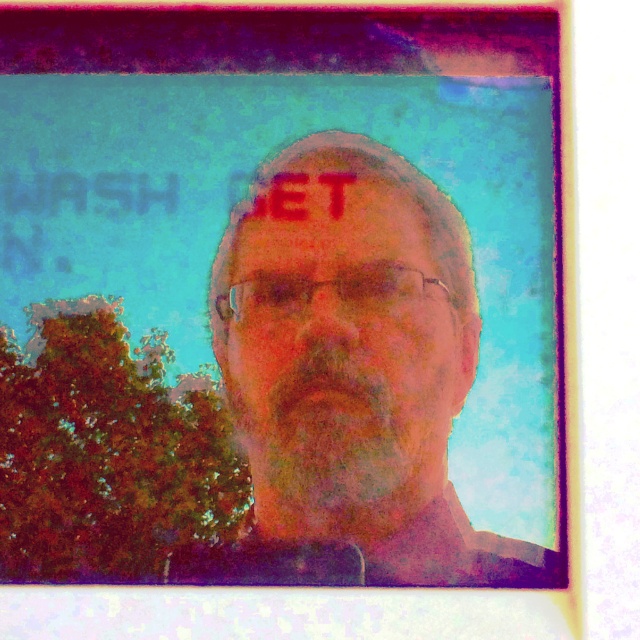
In the scene shown: Which of these two, matte skin face at center or matte skin at center, stands taller?

With more height is matte skin face at center.

Is matte skin face at center below matte skin at center?

Indeed, matte skin face at center is positioned under matte skin at center.

Does point (292, 465) come in front of point (236, 234)?

Yes, point (292, 465) is in front of point (236, 234).

Image resolution: width=640 pixels, height=640 pixels. In order to click on matte skin face at center in this screenshot , I will do `click(339, 340)`.

Who is more distant from viewer, (445, 246) or (339, 248)?

Positioned behind is point (339, 248).

Can you confirm if matte black face at center is positioned to the right of matte skin at center?

Indeed, matte black face at center is positioned on the right side of matte skin at center.

Between point (515, 577) and point (422, 227), which one is positioned in front?

Point (515, 577) is more forward.

Where is `matte black face at center`? This screenshot has width=640, height=640. matte black face at center is located at coordinates (349, 376).

The height and width of the screenshot is (640, 640). Describe the element at coordinates (349, 376) in the screenshot. I see `matte black face at center` at that location.

Locate an element on the screen. matte black face at center is located at coordinates (349, 376).